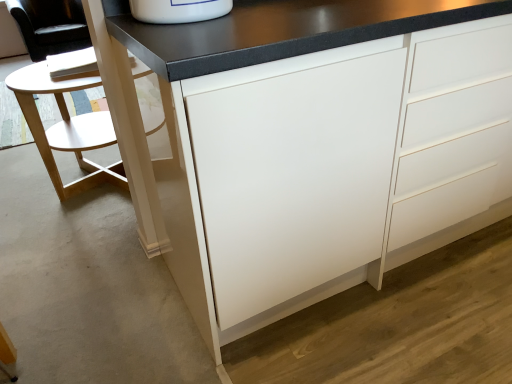
This screenshot has height=384, width=512. What do you see at coordinates (50, 26) in the screenshot?
I see `dark gray fabric swivel chair at left` at bounding box center [50, 26].

Image resolution: width=512 pixels, height=384 pixels. I want to click on dark gray fabric swivel chair at left, so click(x=50, y=26).

Where is `dark gray fabric swivel chair at left`? dark gray fabric swivel chair at left is located at coordinates (50, 26).